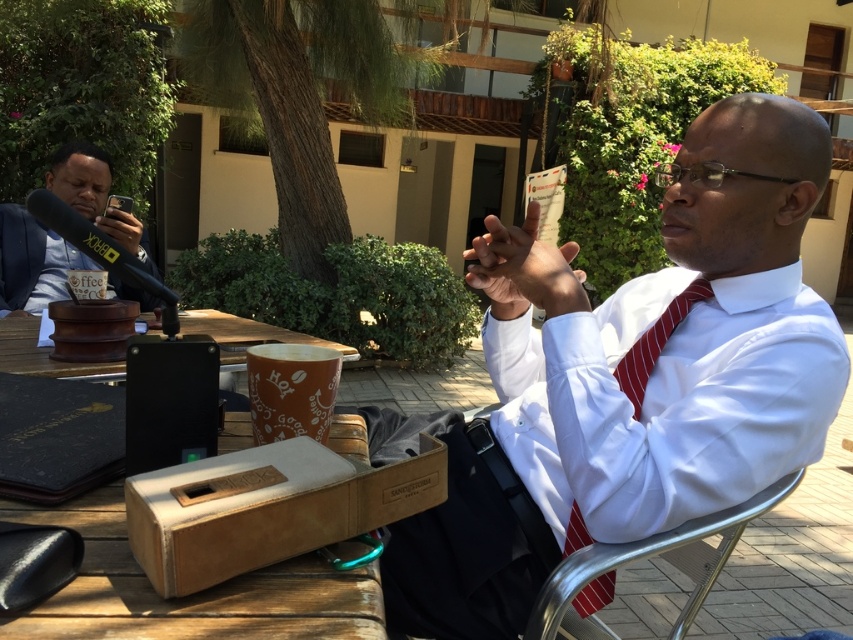
Question: Is silver metallic chair at center positioned in front of brown wooden table at center?

Choices:
 (A) no
 (B) yes

Answer: (B)

Question: Which object is closer to the camera taking this photo?

Choices:
 (A) brown wooden table at center
 (B) matte black microphone at left

Answer: (A)

Question: Is the position of matte black microphone at left less distant than that of red striped tie at center?

Choices:
 (A) yes
 (B) no

Answer: (B)

Question: Which point is closer to the camera taking this photo?

Choices:
 (A) (204, 314)
 (B) (222, 369)

Answer: (B)

Question: Which object is closer to the camera taking this photo?

Choices:
 (A) silver metallic chair at center
 (B) wooden picnic table at center
 (C) matte black microphone at left

Answer: (A)

Question: Can you confirm if brown wooden table at center is smaller than red striped tie at center?

Choices:
 (A) yes
 (B) no

Answer: (B)